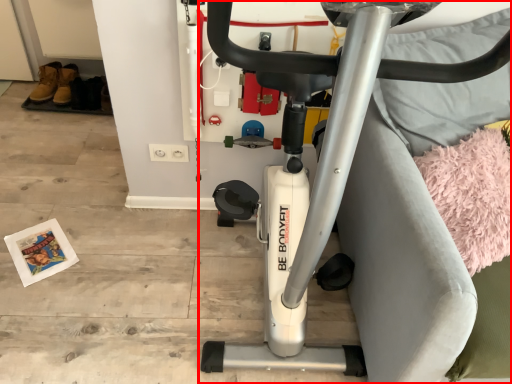
Question: From the image, what is the correct spatial relationship of stationary bicycle (annotated by the red box) in relation to yoga mat?

Choices:
 (A) right
 (B) left

Answer: (B)